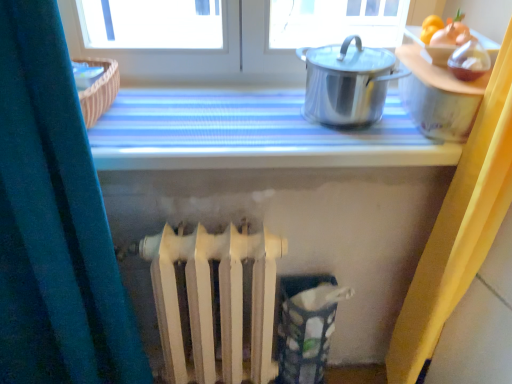
Question: Do you think polished stainless steel pot at upper right is within metallic silver pot at upper right, or outside of it?

Choices:
 (A) inside
 (B) outside

Answer: (B)

Question: Would you say polished stainless steel pot at upper right is to the left or to the right of metallic silver pot at upper right in the picture?

Choices:
 (A) left
 (B) right

Answer: (B)

Question: Estimate the real-world distances between objects in this image. Which object is closer to the white matte radiator at center?

Choices:
 (A) polished stainless steel pot at upper right
 (B) metallic silver pot at upper right

Answer: (B)

Question: Estimate the real-world distances between objects in this image. Which object is farther from the white matte radiator at center?

Choices:
 (A) metallic silver pot at upper right
 (B) polished stainless steel pot at upper right

Answer: (B)